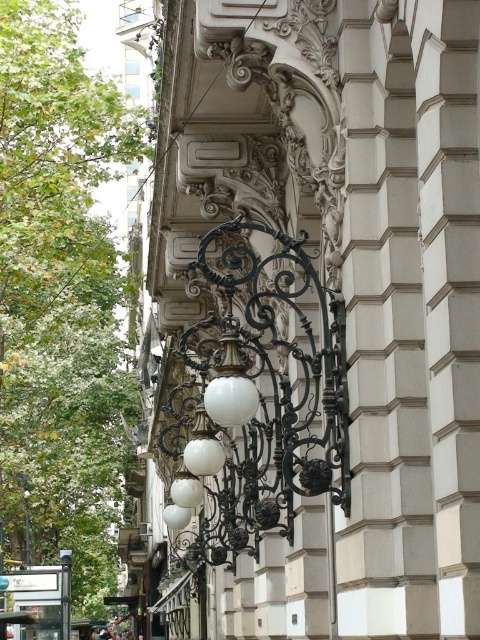
You are an architect designing a new building facade and want to ensure proper spacing between the white matte lamp at center and the white matte lamp post at lower left. Based on the image, which object has a greater width?

The white matte lamp at center is wider than the white matte lamp post at lower left according to the description.